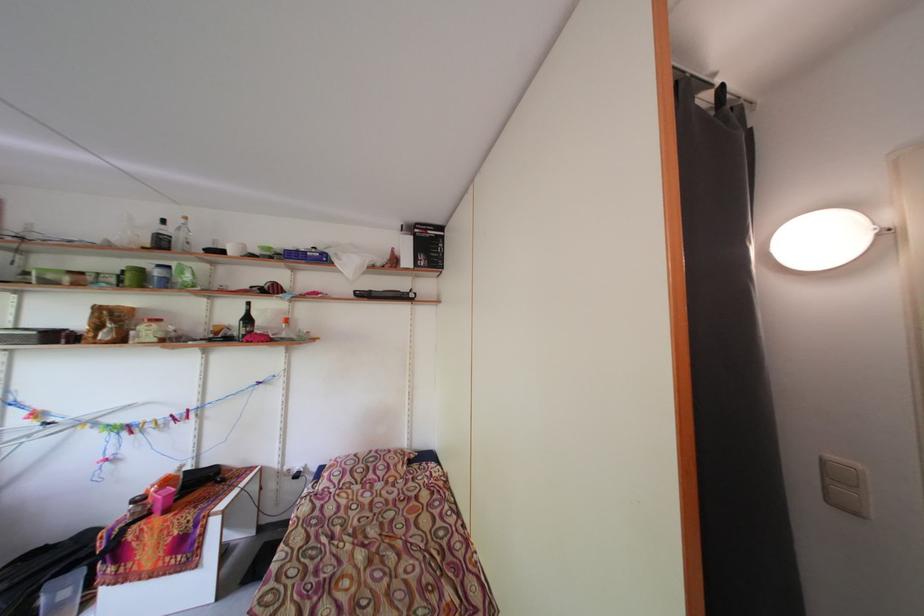
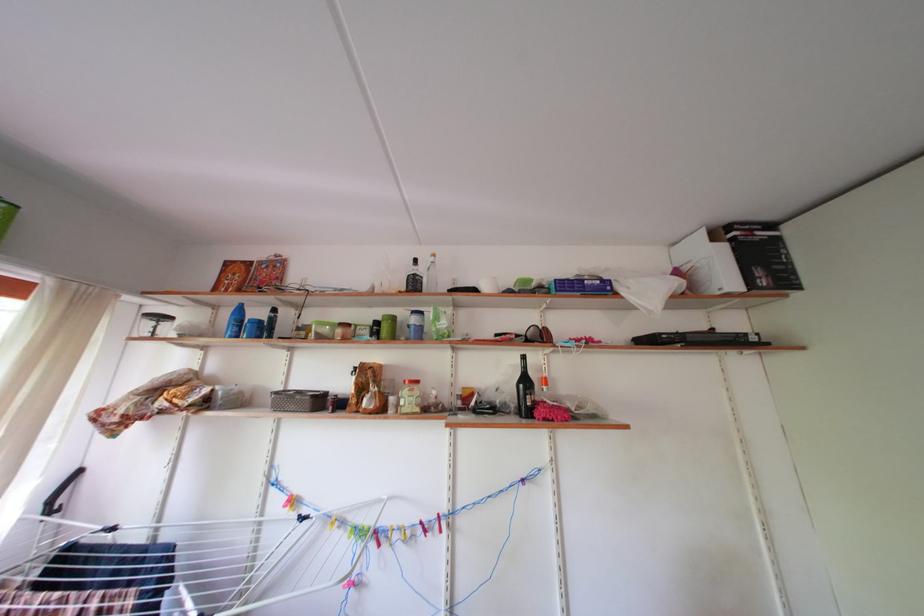
Locate, in the second image, the point that corresponds to [176,236] in the first image.

(430, 276)